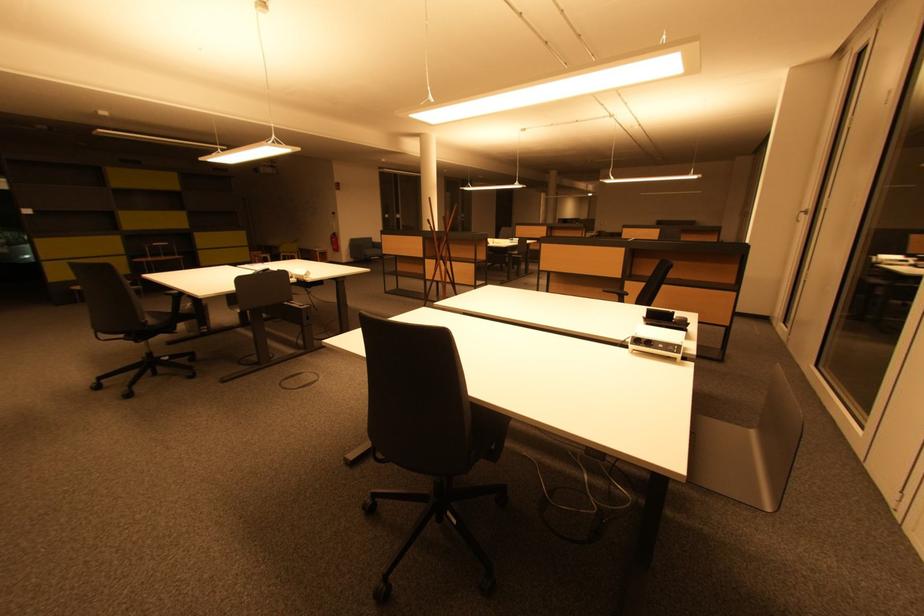
Which object does [334,241] point to?

It corresponds to the red fire extinguisher in the image.